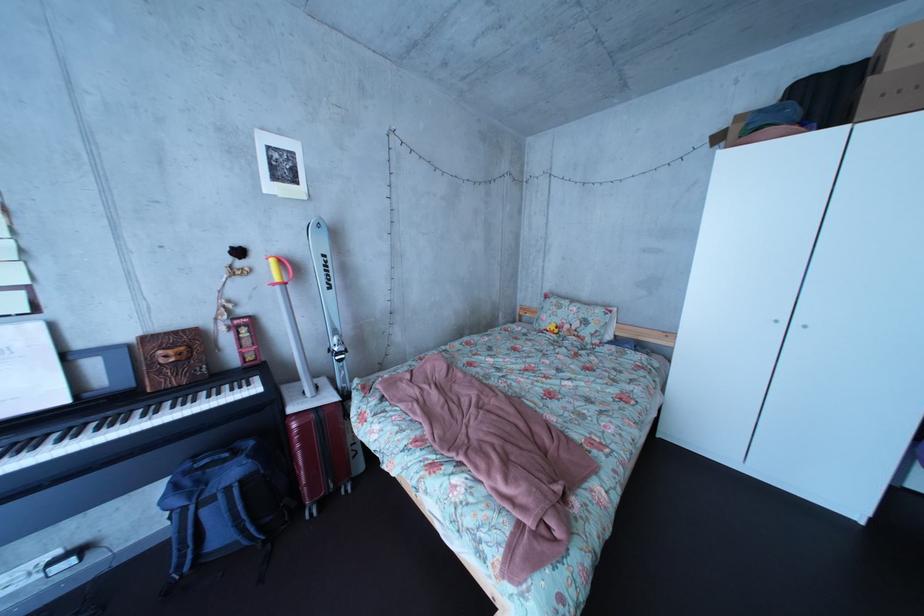
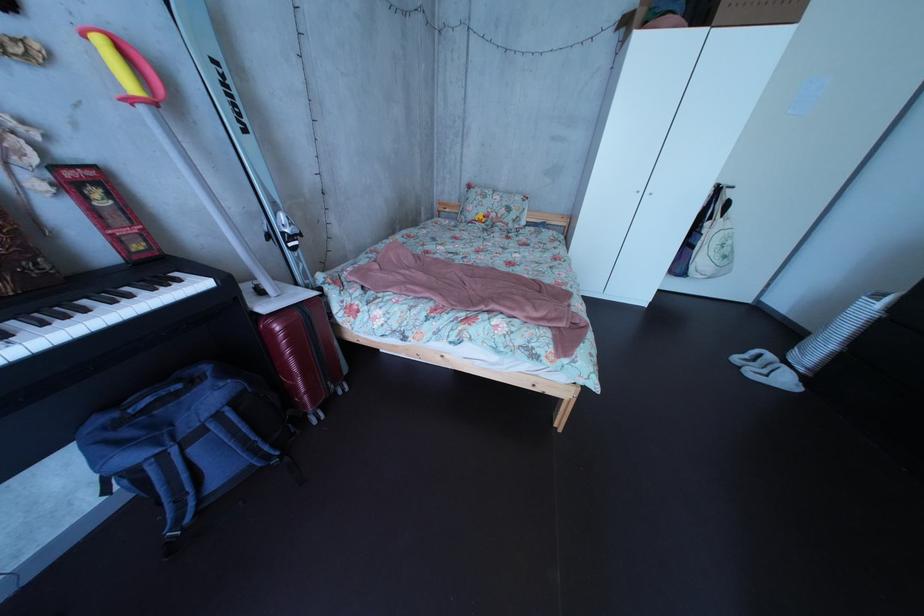
In the second image, find the point that corresponds to (286,269) in the first image.

(116, 51)